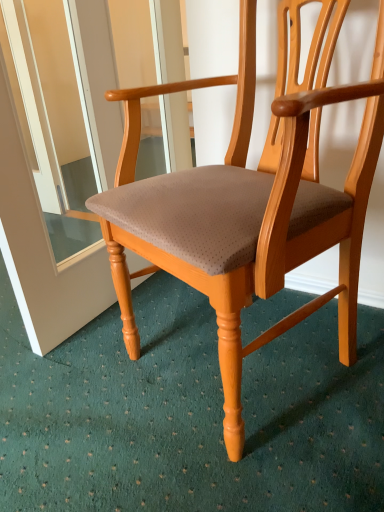
Where is `light brown wood chair at center`? This screenshot has width=384, height=512. light brown wood chair at center is located at coordinates (244, 219).

Describe the element at coordinates (244, 219) in the screenshot. I see `light brown wood chair at center` at that location.

What is the approximate width of light brown wood chair at center?

It is 25.10 inches.

Where is `light brown wood chair at center`? The height and width of the screenshot is (512, 384). light brown wood chair at center is located at coordinates (x=244, y=219).